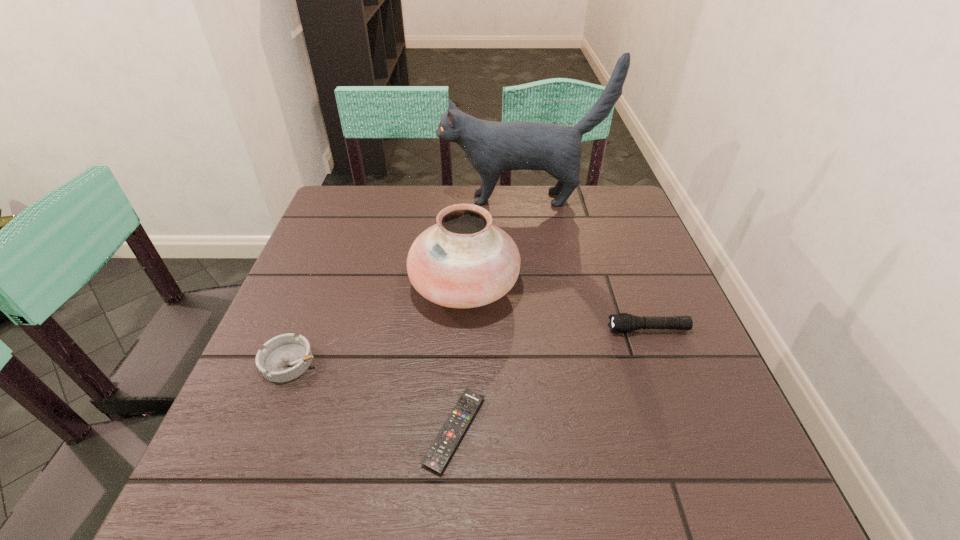
Where is `vacant region at the near right corner`? This screenshot has height=540, width=960. vacant region at the near right corner is located at coordinates (736, 475).

I want to click on vacant area that lies between the remote control and the leftmost object, so click(x=372, y=396).

Identify the location of free space between the leftmost object and the farthest object. (406, 280).

Where is `empty location between the shortest object and the leftmost object`? empty location between the shortest object and the leftmost object is located at coordinates (372, 396).

Image resolution: width=960 pixels, height=540 pixels. What are the coordinates of `empty space that is in between the remote control and the farthest object` in the screenshot? It's located at (488, 314).

The width and height of the screenshot is (960, 540). Identify the location of free space between the flashlight and the second tallest object. (557, 308).

Identify the location of free space between the second tallest object and the nearest object. (460, 358).

Where is `vacant area that lies between the remote control and the fourth tallest object`? The height and width of the screenshot is (540, 960). vacant area that lies between the remote control and the fourth tallest object is located at coordinates (372, 396).

In order to click on free area in between the pottery and the ashtray in this screenshot , I will do `click(377, 324)`.

The height and width of the screenshot is (540, 960). I want to click on empty space that is in between the pottery and the remote control, so tap(460, 358).